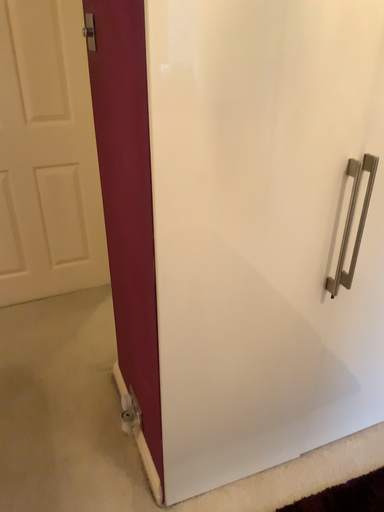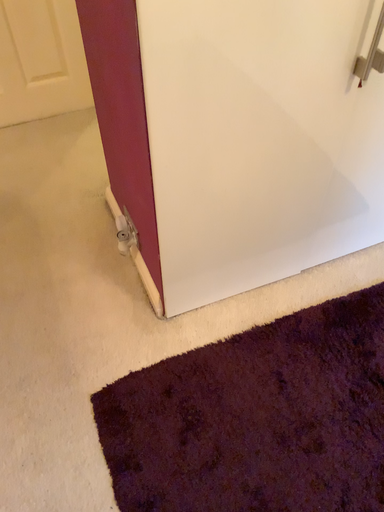
Question: How did the camera likely rotate when shooting the video?

Choices:
 (A) rotated upward
 (B) rotated downward

Answer: (B)